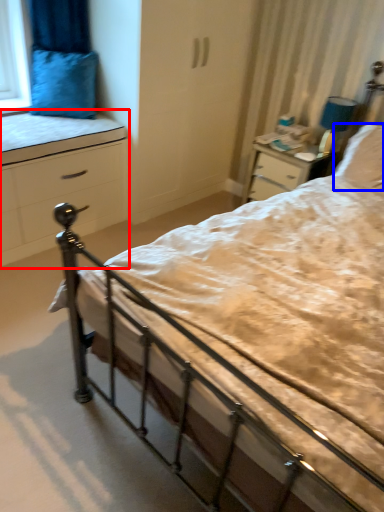
Question: Which of the following is the farthest to the observer, chest of drawers (highlighted by a red box) or pillow (highlighted by a blue box)?

Choices:
 (A) chest of drawers
 (B) pillow

Answer: (B)